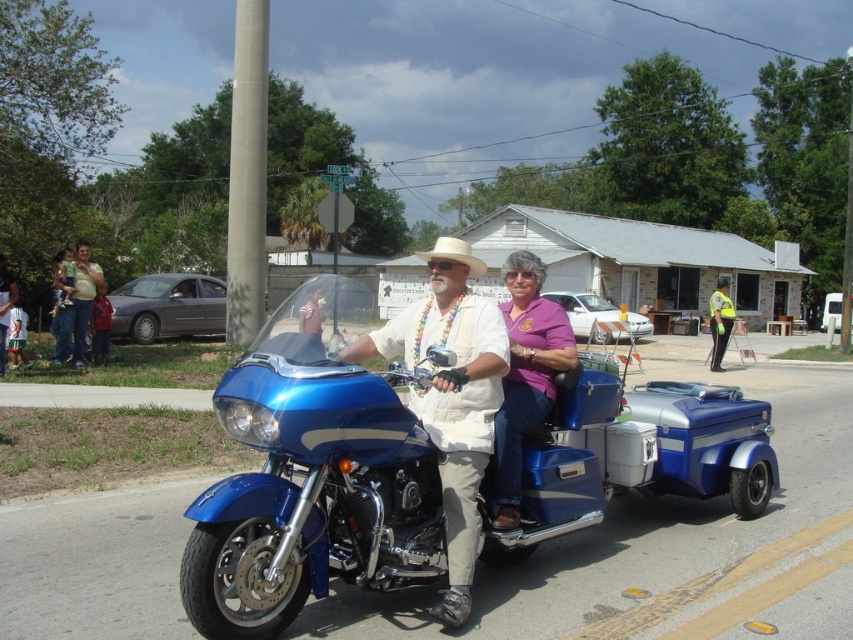
In the scene shown: Is shiny blue motorcycle at center below reflective yellow vest at right?

Yes, shiny blue motorcycle at center is below reflective yellow vest at right.

Who is more distant from viewer, (445, 326) or (715, 356)?

The point (715, 356) is behind.

Locate an element on the screen. shiny blue motorcycle at center is located at coordinates (451, 404).

Consider the image. How distant is shiny blue motorcycle at center from white straw cowboy hat at center?

shiny blue motorcycle at center and white straw cowboy hat at center are 4.56 meters apart.

Looking at this image, can you confirm if shiny blue motorcycle at center is thinner than white straw cowboy hat at center?

Yes, shiny blue motorcycle at center is thinner than white straw cowboy hat at center.

Is point (451, 518) positioned in front of point (434, 252)?

Yes, it is.

At what (x,y) coordinates should I click in order to perform the action: click on shiny blue motorcycle at center. Please return your answer as a coordinate pair (x, y). Looking at the image, I should click on click(451, 404).

Which is above, blue metallic sidecar at lower right or purple matte shirt at center?

blue metallic sidecar at lower right is higher up.

Does blue metallic sidecar at lower right have a greater height compared to purple matte shirt at center?

Yes.

Measure the distance between blue metallic sidecar at lower right and camera.

They are 5.34 meters apart.

Locate an element on the screen. blue metallic sidecar at lower right is located at coordinates (708, 442).